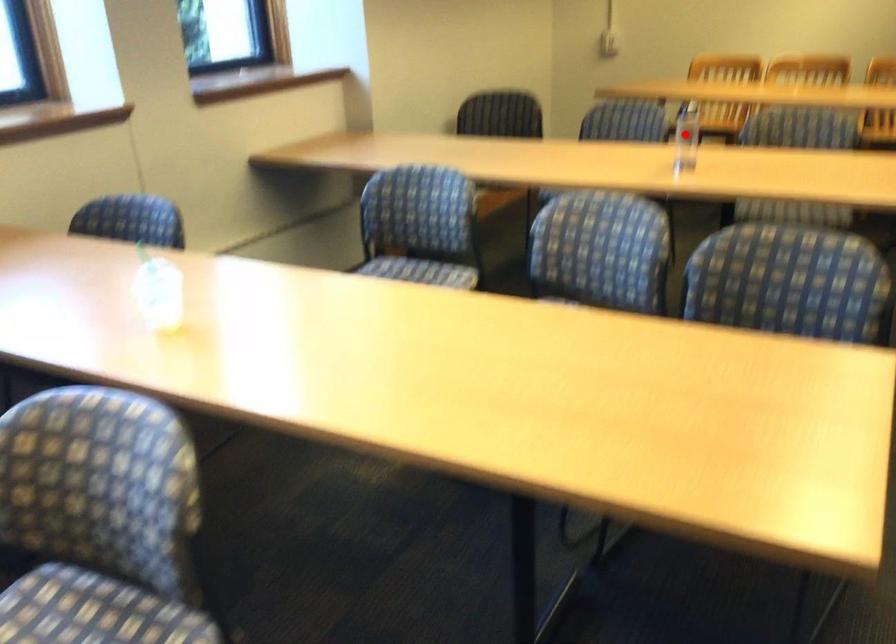
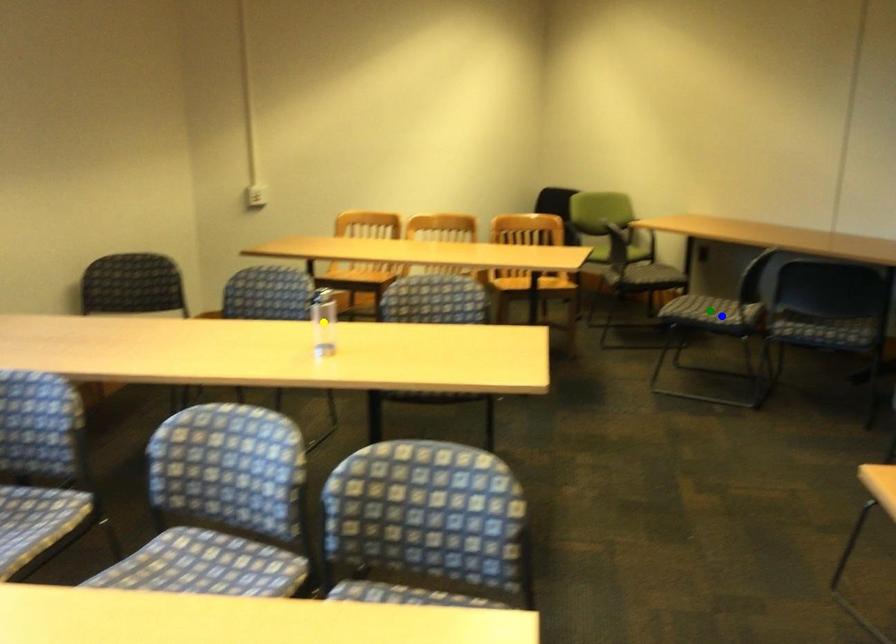
Question: I am providing you with two images of the same scene from different viewpoints. A red point is marked on the first image. You are given multiple points on the second image. Which mark in image 2 goes with the point in image 1?

Choices:
 (A) green point
 (B) yellow point
 (C) blue point

Answer: (B)